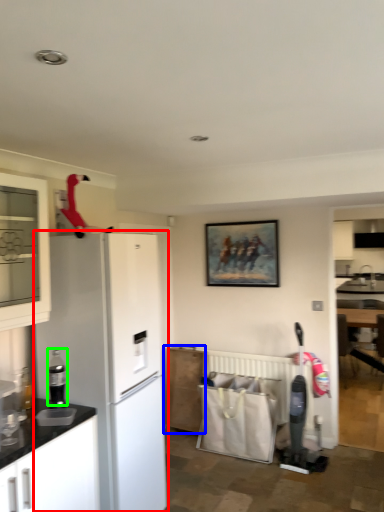
Question: Which is nearer to the refrigerator (highlighted by a red box)? cabinetry (highlighted by a blue box) or appliance (highlighted by a green box).

Choices:
 (A) cabinetry
 (B) appliance

Answer: (B)